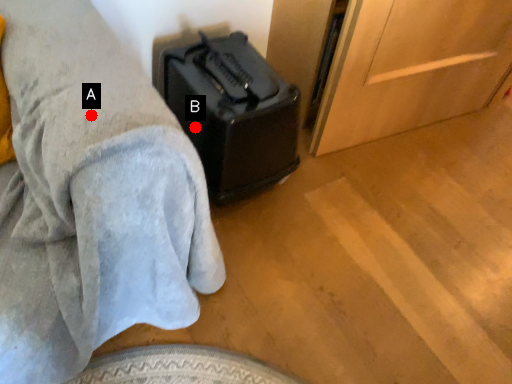
Question: Two points are circled on the image, labeled by A and B beside each circle. Which of the following is the closest to the observer?

Choices:
 (A) A is closer
 (B) B is closer

Answer: (A)